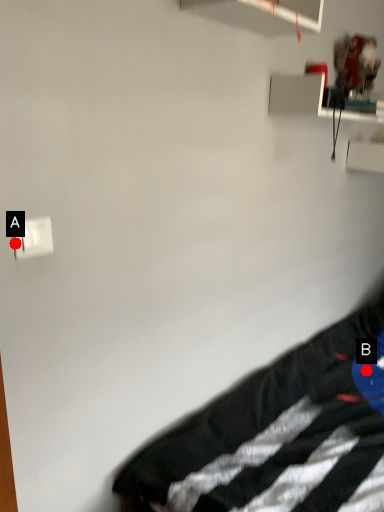
Question: Two points are circled on the image, labeled by A and B beside each circle. Which point appears farthest from the camera in this image?

Choices:
 (A) A is further
 (B) B is further

Answer: (B)